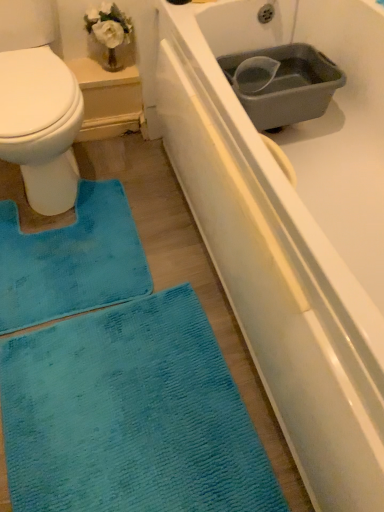
Locate an element on the screen. The image size is (384, 512). blue textured mat at lower left is located at coordinates (71, 260).

Locate an element on the screen. The image size is (384, 512). gray plastic basin at upper right is located at coordinates (282, 83).

Find the location of a particular element. blue textured mat at lower left is located at coordinates point(71,260).

Which of these two, teal soft rug at lower left or blue textured mat at lower left, is smaller?

blue textured mat at lower left.

Are teal soft rug at lower left and blue textured mat at lower left located far from each other?

That's not correct — teal soft rug at lower left is a little close to blue textured mat at lower left.

Based on their positions, is teal soft rug at lower left located to the left or right of blue textured mat at lower left?

Based on their positions, teal soft rug at lower left is located to the right of blue textured mat at lower left.

Is teal soft rug at lower left oriented away from blue textured mat at lower left?

Yes.

Is gray plastic basin at upper right taller or shorter than teal soft rug at lower left?

gray plastic basin at upper right is taller than teal soft rug at lower left.

From a real-world perspective, which is physically below, gray plastic basin at upper right or teal soft rug at lower left?

teal soft rug at lower left, from a real-world perspective.

From the image's perspective, is gray plastic basin at upper right positioned above or below teal soft rug at lower left?

Based on their image positions, gray plastic basin at upper right is located above teal soft rug at lower left.

Is gray plastic basin at upper right spatially inside teal soft rug at lower left, or outside of it?

gray plastic basin at upper right is spatially situated outside teal soft rug at lower left.

From the image's perspective, is white matte bathtub at center under blue textured mat at lower left?

Yes, from the image's perspective, white matte bathtub at center is beneath blue textured mat at lower left.

The width and height of the screenshot is (384, 512). I want to click on bathtub below the blue textured mat at lower left (from the image's perspective), so click(x=274, y=258).

Which is more to the left, white matte bathtub at center or blue textured mat at lower left?

From the viewer's perspective, blue textured mat at lower left appears more on the left side.

From a real-world perspective, between white matte bathtub at center and blue textured mat at lower left, who is vertically higher?

blue textured mat at lower left is physically above.

Which of these two, blue textured mat at lower left or white matte bathtub at center, stands shorter?

Standing shorter between the two is white matte bathtub at center.

Is blue textured mat at lower left thinner than white matte bathtub at center?

Correct, the width of blue textured mat at lower left is less than that of white matte bathtub at center.

In the image, there is a blue textured mat at lower left. In order to click on bathtub below it (from the image's perspective) in this screenshot , I will do `click(274, 258)`.

Is white matte bathtub at center inside blue textured mat at lower left?

No, white matte bathtub at center is not a part of blue textured mat at lower left.

From the image's perspective, is gray plastic basin at upper right positioned above or below white matte bathtub at center?

gray plastic basin at upper right is situated higher than white matte bathtub at center in the image.

Is gray plastic basin at upper right taller than white matte bathtub at center?

Yes, gray plastic basin at upper right is taller than white matte bathtub at center.

Considering the points (275, 128) and (322, 463), which point is behind, point (275, 128) or point (322, 463)?

The point (275, 128) is farther from the camera.

Considering the positions of objects gray plastic basin at upper right and white matte bathtub at center in the image provided, who is in front, gray plastic basin at upper right or white matte bathtub at center?

Positioned in front is white matte bathtub at center.

Is blue fabric bidet at lower left to the right of teal soft rug at lower left from the viewer's perspective?

No.

Considering the sizes of objects blue fabric bidet at lower left and teal soft rug at lower left in the image provided, who is shorter, blue fabric bidet at lower left or teal soft rug at lower left?

With less height is teal soft rug at lower left.

How different are the orientations of blue fabric bidet at lower left and teal soft rug at lower left in degrees?

The angle between the facing direction of blue fabric bidet at lower left and the facing direction of teal soft rug at lower left is 1.18 degrees.

Consider the image. Is blue fabric bidet at lower left thinner than teal soft rug at lower left?

No.

From a real-world perspective, relative to teal soft rug at lower left, is white matte bathtub at center vertically above or below?

white matte bathtub at center is situated lower than teal soft rug at lower left in the real world.

Looking at this image, is white matte bathtub at center to the left of teal soft rug at lower left from the viewer's perspective?

In fact, white matte bathtub at center is to the right of teal soft rug at lower left.

At what (x,y) coordinates should I click in order to perform the action: click on bathtub on the right of teal soft rug at lower left. Please return your answer as a coordinate pair (x, y). This screenshot has width=384, height=512. Looking at the image, I should click on (274, 258).

At what (x,y) coordinates should I click in order to perform the action: click on doormat behind the teal soft rug at lower left. Please return your answer as a coordinate pair (x, y). This screenshot has width=384, height=512. Looking at the image, I should click on (71, 260).

Identify the location of bath mat below the gray plastic basin at upper right (from a real-world perspective). This screenshot has width=384, height=512. (130, 416).

Looking at the image, which one is located closer to white matte bathtub at center, blue fabric bidet at lower left or gray plastic basin at upper right?

gray plastic basin at upper right is positioned closer to the anchor white matte bathtub at center.

Based on their spatial positions, is gray plastic basin at upper right or blue fabric bidet at lower left closer to blue textured mat at lower left?

Among the two, blue fabric bidet at lower left is located nearer to blue textured mat at lower left.

Looking at the image, which one is located further to teal soft rug at lower left, gray plastic basin at upper right or white matte bathtub at center?

Based on the image, gray plastic basin at upper right appears to be further to teal soft rug at lower left.

Which object lies nearer to the anchor point teal soft rug at lower left, blue textured mat at lower left or white matte bathtub at center?

Based on the image, blue textured mat at lower left appears to be nearer to teal soft rug at lower left.

Based on their spatial positions, is white matte bathtub at center or blue fabric bidet at lower left closer to gray plastic basin at upper right?

white matte bathtub at center is positioned closer to the anchor gray plastic basin at upper right.

From the picture: Based on their spatial positions, is white matte bathtub at center or gray plastic basin at upper right further from teal soft rug at lower left?

The object further to teal soft rug at lower left is gray plastic basin at upper right.

Considering their positions, is blue fabric bidet at lower left positioned closer to blue textured mat at lower left than gray plastic basin at upper right?

blue fabric bidet at lower left is closer to blue textured mat at lower left.

When comparing their distances from blue textured mat at lower left, does blue fabric bidet at lower left or teal soft rug at lower left seem further?

teal soft rug at lower left.

This screenshot has height=512, width=384. Find the location of `bathtub between blue textured mat at lower left and teal soft rug at lower left in the up-down direction`. bathtub between blue textured mat at lower left and teal soft rug at lower left in the up-down direction is located at coordinates (274, 258).

The height and width of the screenshot is (512, 384). What are the coordinates of `doormat situated between blue fabric bidet at lower left and gray plastic basin at upper right from left to right` in the screenshot? It's located at (71, 260).

Identify the location of doormat between gray plastic basin at upper right and teal soft rug at lower left vertically. The height and width of the screenshot is (512, 384). (71, 260).

Where is `doormat between blue fabric bidet at lower left and teal soft rug at lower left vertically`? doormat between blue fabric bidet at lower left and teal soft rug at lower left vertically is located at coordinates (71, 260).